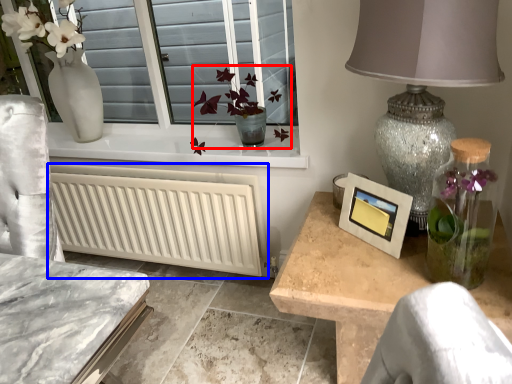
Question: Which object appears closest to the camera in this image, floral arrangement (highlighted by a red box) or radiator (highlighted by a blue box)?

Choices:
 (A) floral arrangement
 (B) radiator

Answer: (A)